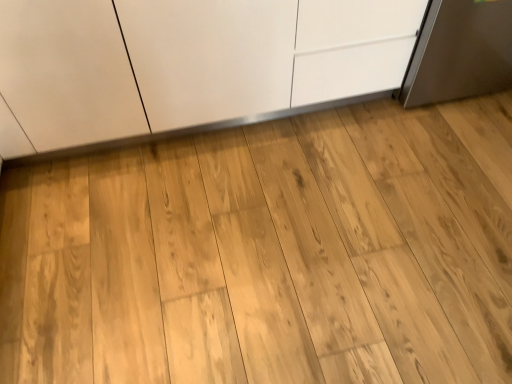
Question: Do you think natural wood dresser at center is within matte white cabinet at center, or outside of it?

Choices:
 (A) inside
 (B) outside

Answer: (B)

Question: Is point (370, 311) closer or farther from the camera than point (38, 99)?

Choices:
 (A) closer
 (B) farther

Answer: (A)

Question: Is natural wood dresser at center taller or shorter than matte white cabinet at center?

Choices:
 (A) short
 (B) tall

Answer: (A)

Question: From the image's perspective, is matte white cabinet at center positioned above or below natural wood dresser at center?

Choices:
 (A) below
 (B) above

Answer: (B)

Question: In terms of height, does matte white cabinet at center look taller or shorter compared to natural wood dresser at center?

Choices:
 (A) short
 (B) tall

Answer: (B)

Question: From a real-world perspective, is matte white cabinet at center positioned above or below natural wood dresser at center?

Choices:
 (A) above
 (B) below

Answer: (A)

Question: Considering the positions of matte white cabinet at center and natural wood dresser at center in the image, is matte white cabinet at center wider or thinner than natural wood dresser at center?

Choices:
 (A) wide
 (B) thin

Answer: (B)